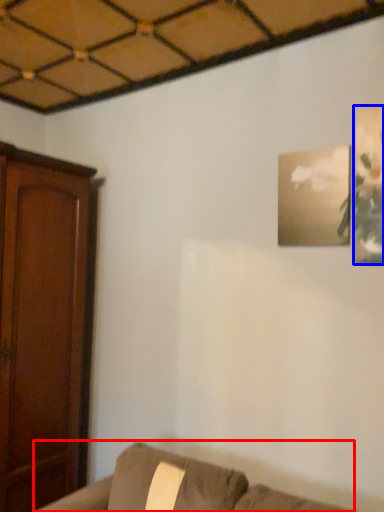
Question: Among these objects, which one is nearest to the camera, furniture (highlighted by a red box) or picture frame (highlighted by a blue box)?

Choices:
 (A) furniture
 (B) picture frame

Answer: (A)